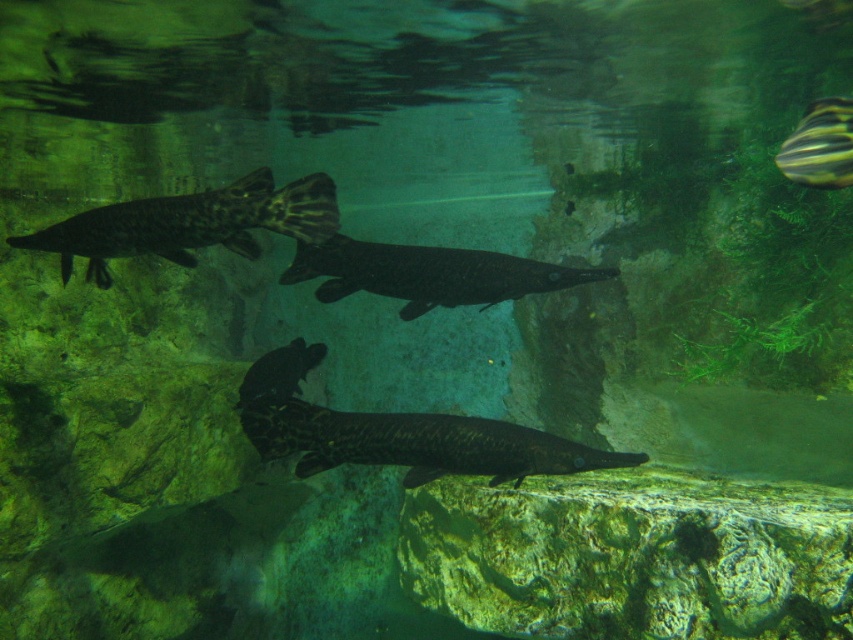
You are an underwater photographer aiming to capture a closeup shot of both the dark spotted fish at center and the dark gray matte fish at center. Given that your camera lens has a maximum width coverage of 15 cm, can you determine if both fish can fit within the frame at the same time?

The dark spotted fish at center is wider than the dark gray matte fish at center. However, the exact widths are not provided, so it is impossible to determine if their combined width exceeds the 15 cm limit. You may need to adjust your position or zoom level to ensure both fit within the frame.

You are a marine biologist observing an underwater scene. You notice a point marked at coordinates (190, 224). Which object is located at that point?

The point at (190, 224) marks the dark brown textured fish at upper left.